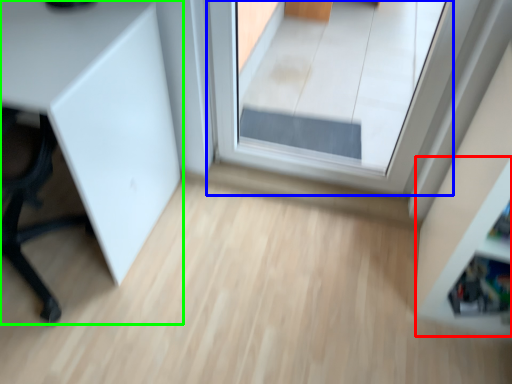
Question: Which is nearer to the shelf (highlighted by a red box)? window (highlighted by a blue box) or furniture (highlighted by a green box).

Choices:
 (A) window
 (B) furniture

Answer: (B)